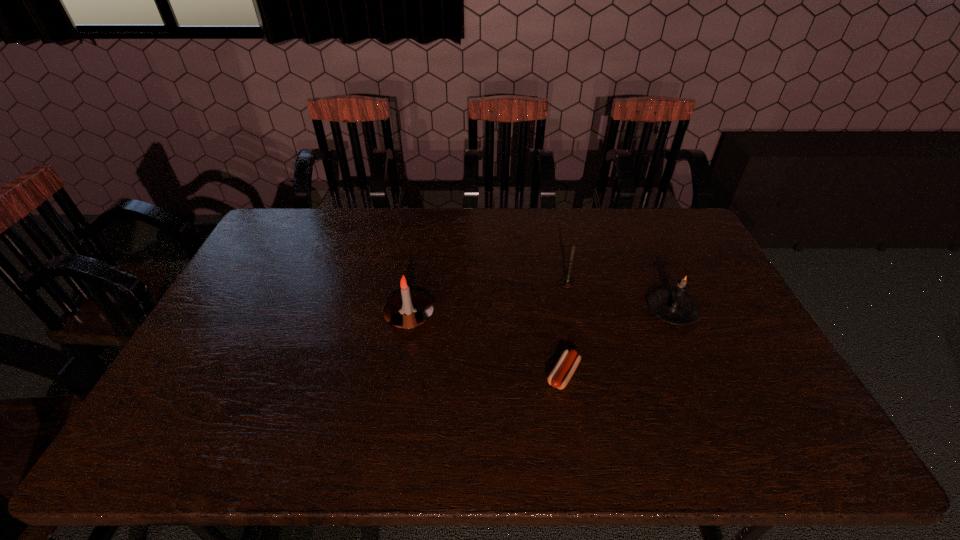
Where is `object that is positioned at the right edge`? This screenshot has width=960, height=540. object that is positioned at the right edge is located at coordinates (674, 306).

In the image, there is a desktop. Where is `vacant space at the far edge`? Image resolution: width=960 pixels, height=540 pixels. vacant space at the far edge is located at coordinates (537, 233).

Locate an element on the screen. The image size is (960, 540). blank space at the left edge is located at coordinates (223, 305).

Where is `vacant position at the right edge of the desktop`? The image size is (960, 540). vacant position at the right edge of the desktop is located at coordinates (752, 375).

At what (x,y) coordinates should I click in order to perform the action: click on vacant space at the far left corner of the desktop. Please return your answer as a coordinate pair (x, y). Looking at the image, I should click on (300, 234).

Identify the location of vacant area that lies between the farthest object and the rightmost candle. The image size is (960, 540). (620, 297).

Where is `empty space that is in between the leftmost object and the farthest object`? This screenshot has height=540, width=960. empty space that is in between the leftmost object and the farthest object is located at coordinates (489, 300).

Find the location of a particular element. blank region between the rightmost object and the sausage is located at coordinates coord(618,343).

Where is `blank region between the shortest object and the leftmost candle`? The image size is (960, 540). blank region between the shortest object and the leftmost candle is located at coordinates (486, 345).

Locate an element on the screen. This screenshot has width=960, height=540. blank region between the rightmost candle and the sausage is located at coordinates (618, 343).